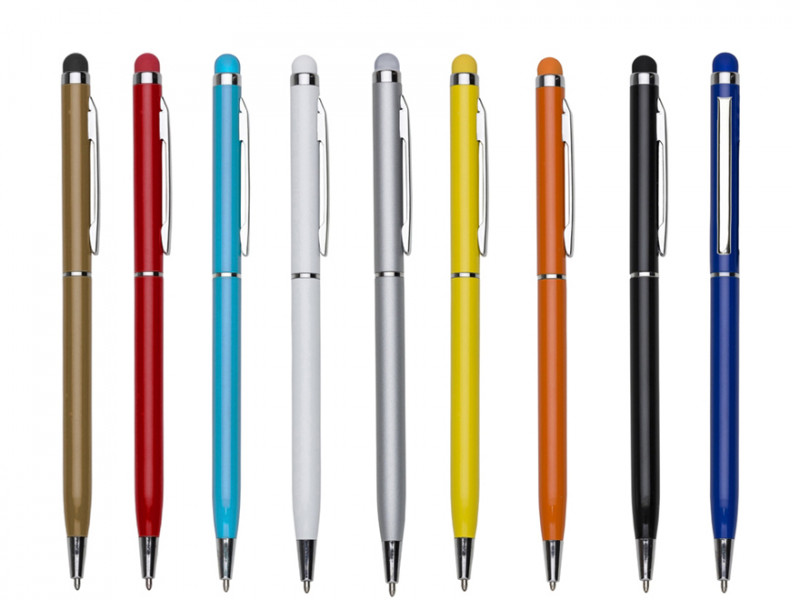
Where is `pens`? pens is located at coordinates [82, 273], [150, 289], [226, 273], [301, 298], [388, 270], [460, 292], [542, 277], [638, 293], [714, 274].